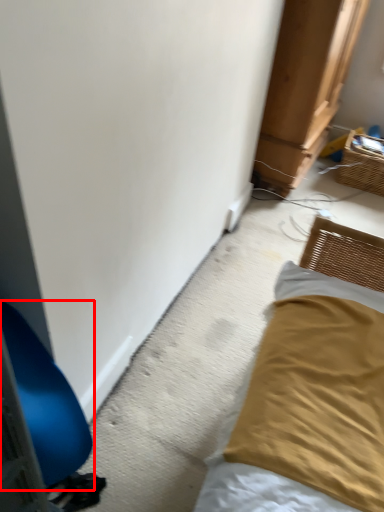
Question: From the image's perspective, what is the correct spatial positioning of furniture (annotated by the red box) in reference to basket?

Choices:
 (A) above
 (B) below

Answer: (B)